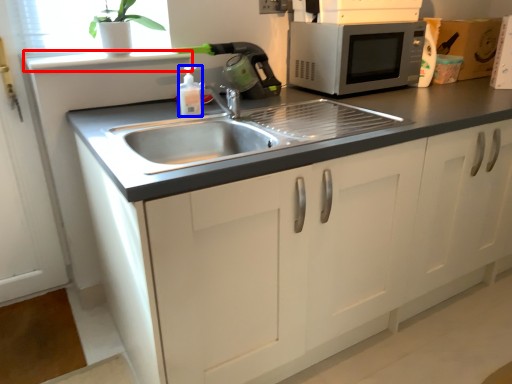
Question: Which of the following is the closest to the observer, window sill (highlighted by a red box) or bottle (highlighted by a blue box)?

Choices:
 (A) window sill
 (B) bottle

Answer: (B)